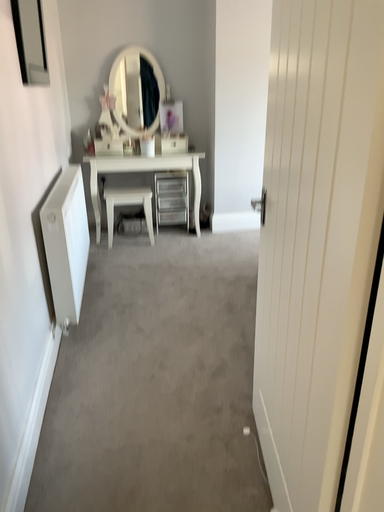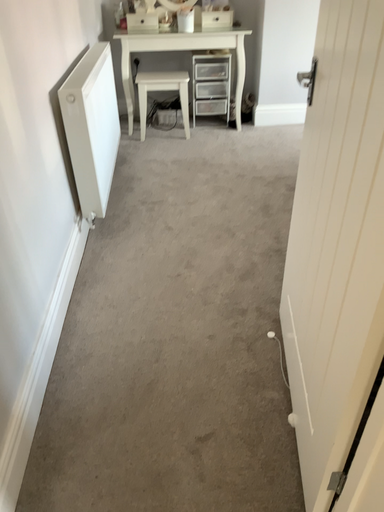
Question: Which way did the camera rotate in the video?

Choices:
 (A) rotated upward
 (B) rotated downward

Answer: (B)